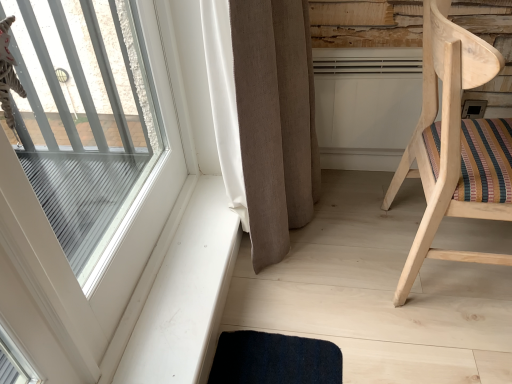
The width and height of the screenshot is (512, 384). I want to click on free area below natural wood chair at right (from a real-world perspective), so coord(449,256).